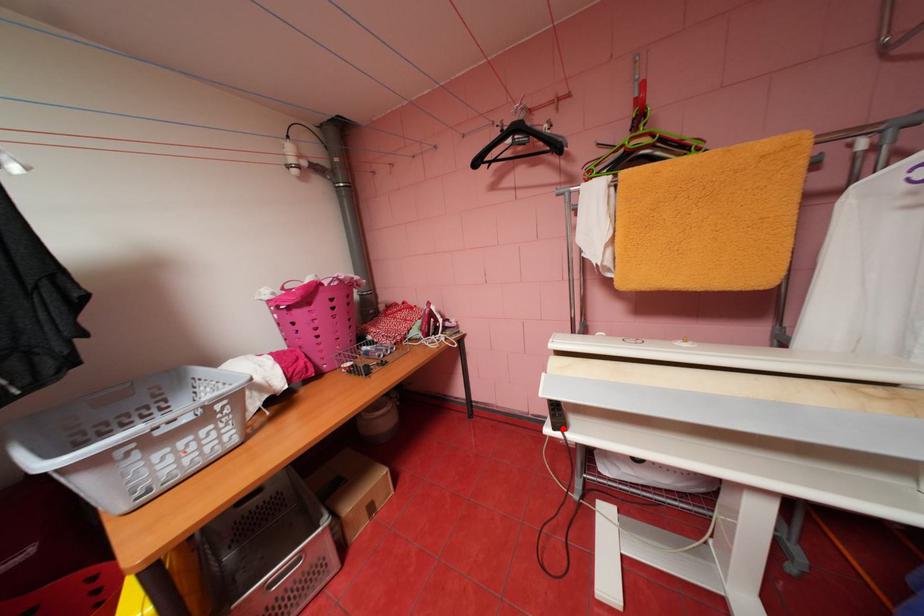
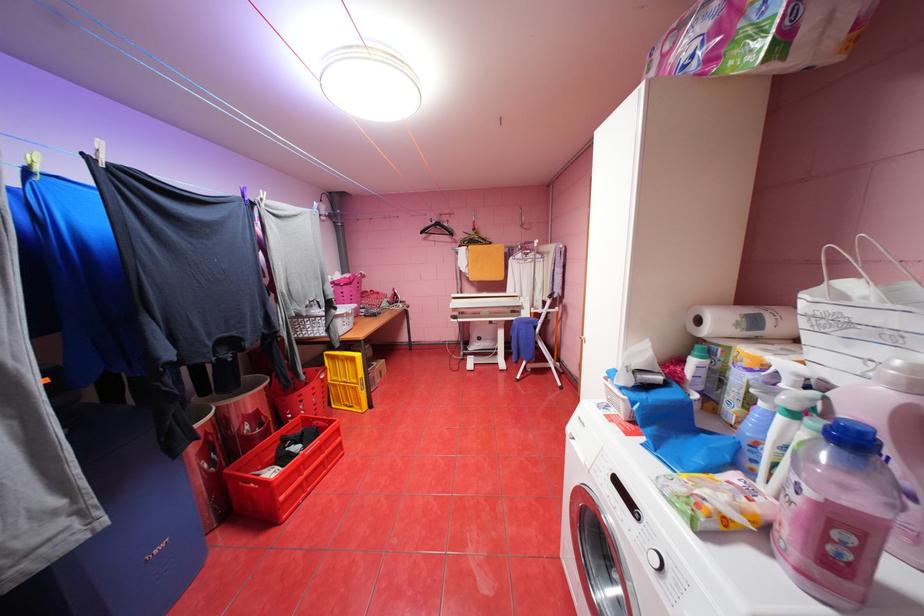
Question: I am providing you with two images of the same scene from different viewpoints. A red point is marked on the first image. Is the red point's position out of view in image 2?

Choices:
 (A) Yes
 (B) No

Answer: (A)